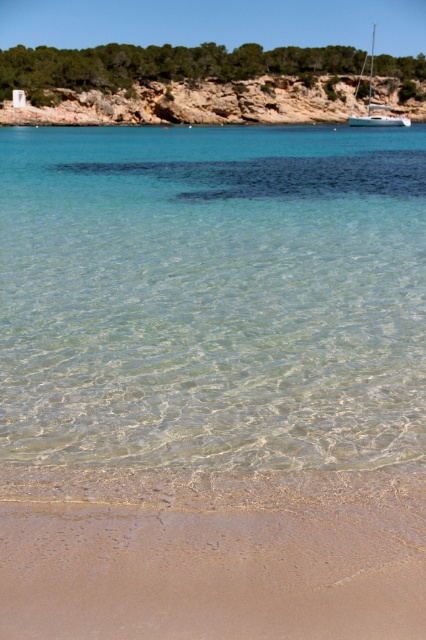
You are standing on the beach in the coastal scene. You see two points marked on the image. The first point is at coordinate point[236,605] and the second is at point[368,81]. Which point is closer to you?

Point[236,605] is in front of point[368,81], so it is closer to you.